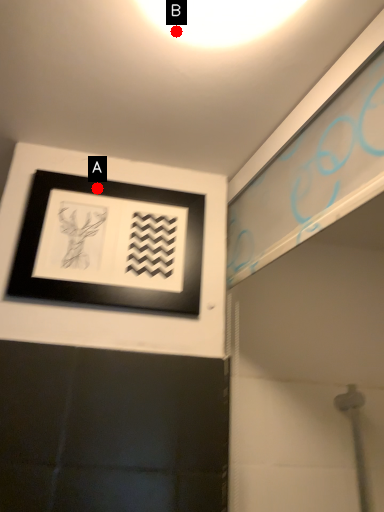
Question: Two points are circled on the image, labeled by A and B beside each circle. Which of the following is the closest to the observer?

Choices:
 (A) A is closer
 (B) B is closer

Answer: (B)